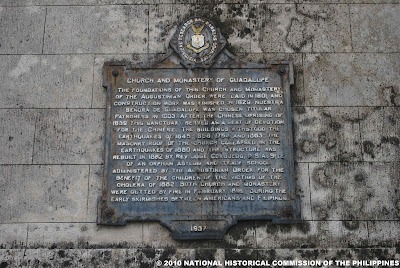
Identify the location of stone tiles. The image size is (400, 268). (70, 26), (22, 200).